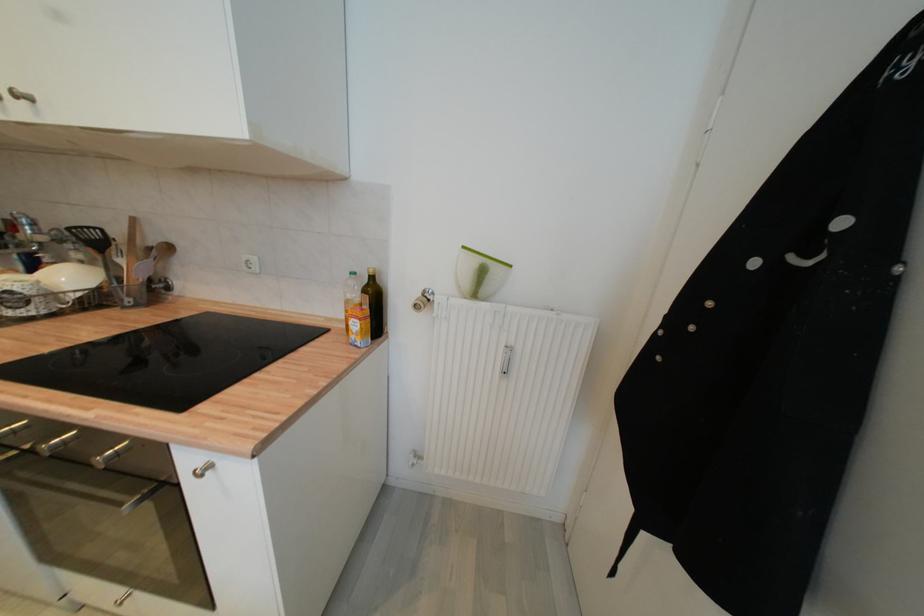
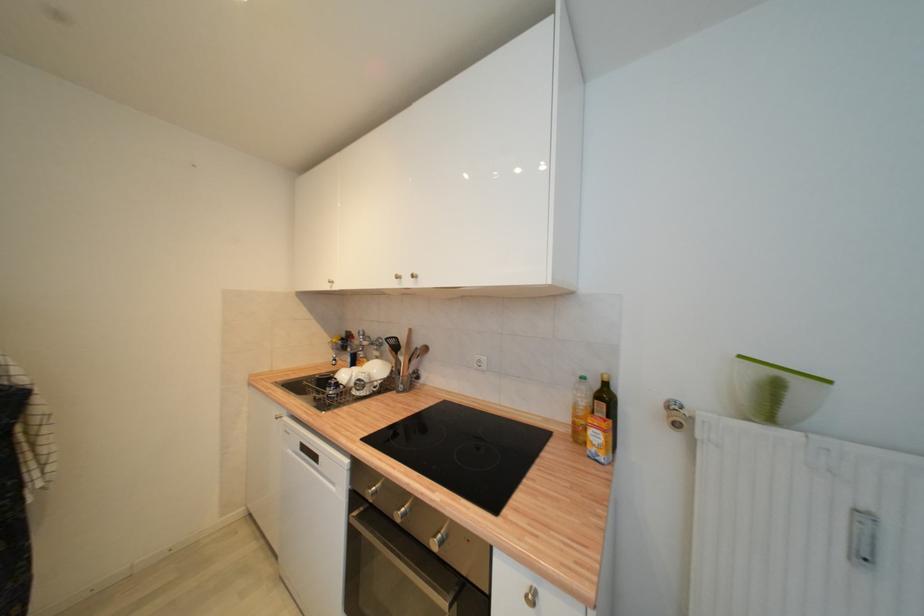
The point at (157, 241) is marked in the first image. Where is the corresponding point in the second image?

(422, 345)